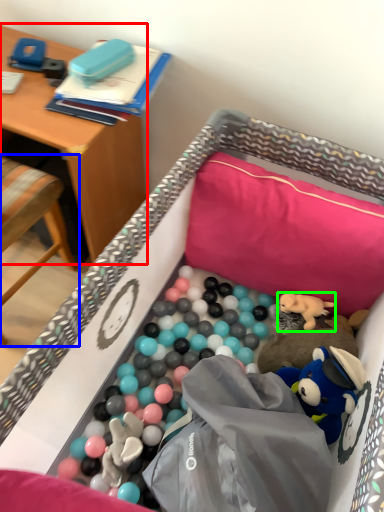
Question: Estimate the real-world distances between objects in this image. Which object is closer to desk (highlighted by a red box), chair (highlighted by a blue box) or toy (highlighted by a green box)?

Choices:
 (A) chair
 (B) toy

Answer: (A)